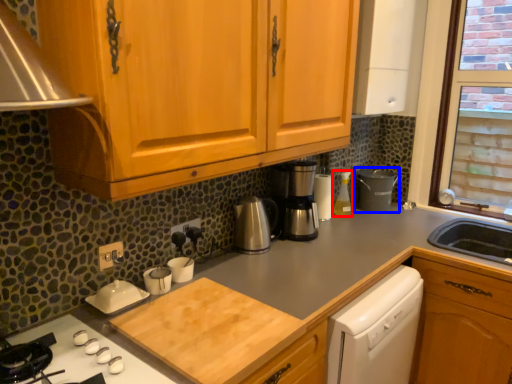
Question: Among these objects, which one is nearest to the camera, bottle (highlighted by a red box) or appliance (highlighted by a blue box)?

Choices:
 (A) bottle
 (B) appliance

Answer: (A)